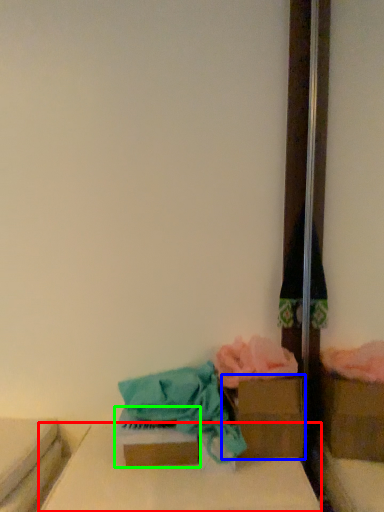
Question: Which is farther away from furniture (highlighted by a red box)? storage box (highlighted by a blue box) or storage box (highlighted by a green box)?

Choices:
 (A) storage box
 (B) storage box

Answer: (A)